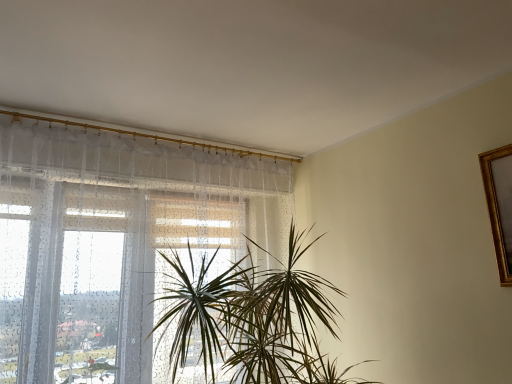
Where is `transparent fabric at left`? transparent fabric at left is located at coordinates (114, 241).

Describe the element at coordinates (114, 241) in the screenshot. I see `transparent fabric at left` at that location.

This screenshot has width=512, height=384. What are the coordinates of `green leafy plant at center` in the screenshot? It's located at (252, 319).

Describe the element at coordinates (252, 319) in the screenshot. Image resolution: width=512 pixels, height=384 pixels. I see `green leafy plant at center` at that location.

Locate an element on the screen. transparent fabric at left is located at coordinates (114, 241).

Is green leafy plant at center at the left side of transparent fabric at left?

No.

Which object is further away from the camera taking this photo, green leafy plant at center or transparent fabric at left?

transparent fabric at left is more distant.

Which is closer, (264, 272) or (237, 216)?

Point (264, 272).

From the image's perspective, is green leafy plant at center under transparent fabric at left?

Indeed, from the image's perspective, green leafy plant at center is shown beneath transparent fabric at left.

From a real-world perspective, is green leafy plant at center under transparent fabric at left?

Yes, from a real-world perspective, green leafy plant at center is beneath transparent fabric at left.

Which of these two, green leafy plant at center or transparent fabric at left, is thinner?

transparent fabric at left is thinner.

Considering the relative sizes of green leafy plant at center and transparent fabric at left in the image provided, is green leafy plant at center taller than transparent fabric at left?

In fact, green leafy plant at center may be shorter than transparent fabric at left.

Considering the relative sizes of green leafy plant at center and transparent fabric at left in the image provided, is green leafy plant at center smaller than transparent fabric at left?

Actually, green leafy plant at center might be larger than transparent fabric at left.

Is transparent fabric at left inside green leafy plant at center?

No, transparent fabric at left is not surrounded by green leafy plant at center.

Is green leafy plant at center touching transparent fabric at left?

No, green leafy plant at center is not in contact with transparent fabric at left.

Is green leafy plant at center aimed at transparent fabric at left?

No.

How much distance is there between green leafy plant at center and transparent fabric at left?

15.95 inches.

The width and height of the screenshot is (512, 384). I want to click on window that is above the green leafy plant at center (from a real-world perspective), so click(114, 241).

Is transparent fabric at left to the left of green leafy plant at center from the viewer's perspective?

Indeed, transparent fabric at left is positioned on the left side of green leafy plant at center.

Which object is further away from the camera, transparent fabric at left or green leafy plant at center?

Positioned behind is transparent fabric at left.

Is point (59, 213) more distant than point (291, 323)?

Yes, it is behind point (291, 323).

From the image's perspective, is transparent fabric at left positioned above or below green leafy plant at center?

Based on their image positions, transparent fabric at left is located above green leafy plant at center.

From a real-world perspective, which object stands above the other?

transparent fabric at left, from a real-world perspective.

Which of these two, transparent fabric at left or green leafy plant at center, is thinner?

Thinner between the two is transparent fabric at left.

Considering the relative sizes of transparent fabric at left and green leafy plant at center in the image provided, is transparent fabric at left shorter than green leafy plant at center?

In fact, transparent fabric at left may be taller than green leafy plant at center.

Considering the sizes of objects transparent fabric at left and green leafy plant at center in the image provided, who is bigger, transparent fabric at left or green leafy plant at center?

green leafy plant at center.

Would you say green leafy plant at center is part of transparent fabric at left's contents?

No.

Based on the photo, is transparent fabric at left far from green leafy plant at center?

No, transparent fabric at left is not far from green leafy plant at center.

Is transparent fabric at left facing towards green leafy plant at center?

Yes, transparent fabric at left faces towards green leafy plant at center.

Locate an element on the screen. The height and width of the screenshot is (384, 512). window behind the green leafy plant at center is located at coordinates (114, 241).

You are a GUI agent. You are given a task and a screenshot of the screen. Output one action in this format:
    pyautogui.click(x=<x>, y=<y>)
    Task: Click on the houseplant on the right side of transparent fabric at left
    Image resolution: width=512 pixels, height=384 pixels.
    Given the screenshot: What is the action you would take?
    pyautogui.click(x=252, y=319)

Find the location of a particular element. The height and width of the screenshot is (384, 512). window above the green leafy plant at center (from the image's perspective) is located at coordinates pyautogui.click(x=114, y=241).